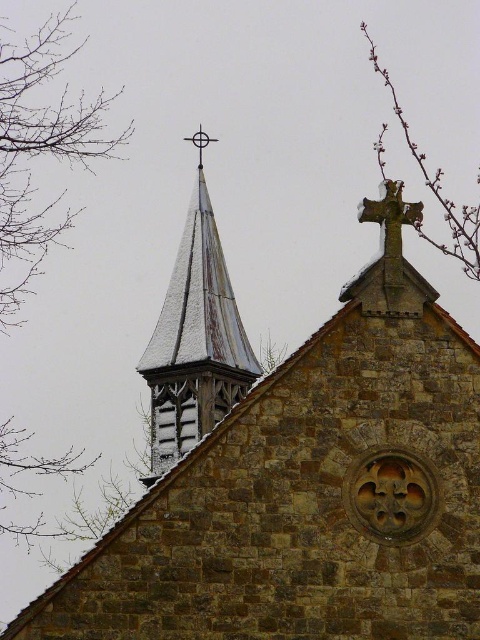
Question: Which of the following is the farthest from the observer?

Choices:
 (A) brown leafless branches at upper left
 (B) brown stone church steeple at upper left
 (C) rusty metal cross at upper right

Answer: (A)

Question: Which of the following is the farthest from the observer?

Choices:
 (A) (397, 225)
 (B) (156, 467)
 (C) (439, 180)
 (D) (443, 365)

Answer: (C)

Question: Can you confirm if brown textured cross at upper right is positioned below rusty metal cross at upper right?

Choices:
 (A) no
 (B) yes

Answer: (A)

Question: Is brown stone church steeple at upper left positioned behind white wooden spire at upper left?

Choices:
 (A) yes
 (B) no

Answer: (B)

Question: Does brown leafless branches at upper left appear on the right side of brown textured cross at upper right?

Choices:
 (A) yes
 (B) no

Answer: (B)

Question: Which point appears closest to the camera in this image?

Choices:
 (A) (170, 337)
 (B) (36, 216)

Answer: (A)